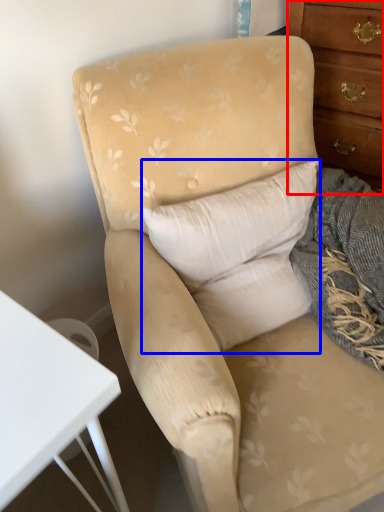
Question: Which point is closer to the camera, chest of drawers (highlighted by a red box) or pillow (highlighted by a blue box)?

Choices:
 (A) chest of drawers
 (B) pillow

Answer: (B)